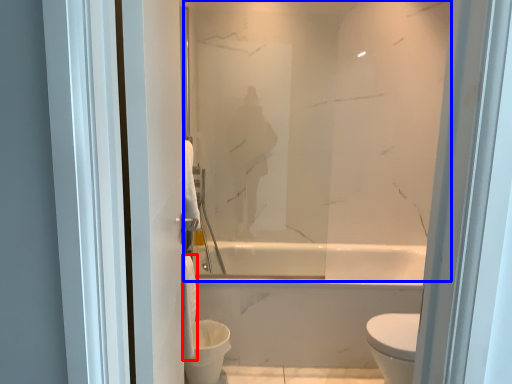
Question: Which of the following is the closest to the observer, toilet paper (highlighted by a red box) or mirror (highlighted by a blue box)?

Choices:
 (A) toilet paper
 (B) mirror

Answer: (A)